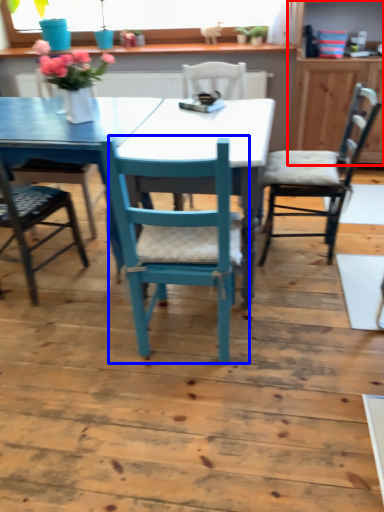
Question: Which object appears farthest to the camera in this image, dresser (highlighted by a red box) or chair (highlighted by a blue box)?

Choices:
 (A) dresser
 (B) chair

Answer: (A)